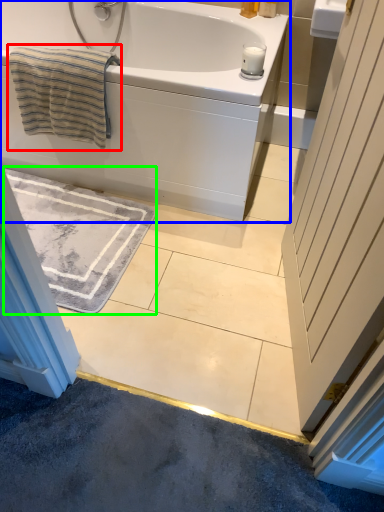
Question: Considering the real-world distances, which object is farthest from beach towel (highlighted by a red box)? bathtub (highlighted by a blue box) or bath mat (highlighted by a green box)?

Choices:
 (A) bathtub
 (B) bath mat

Answer: (B)